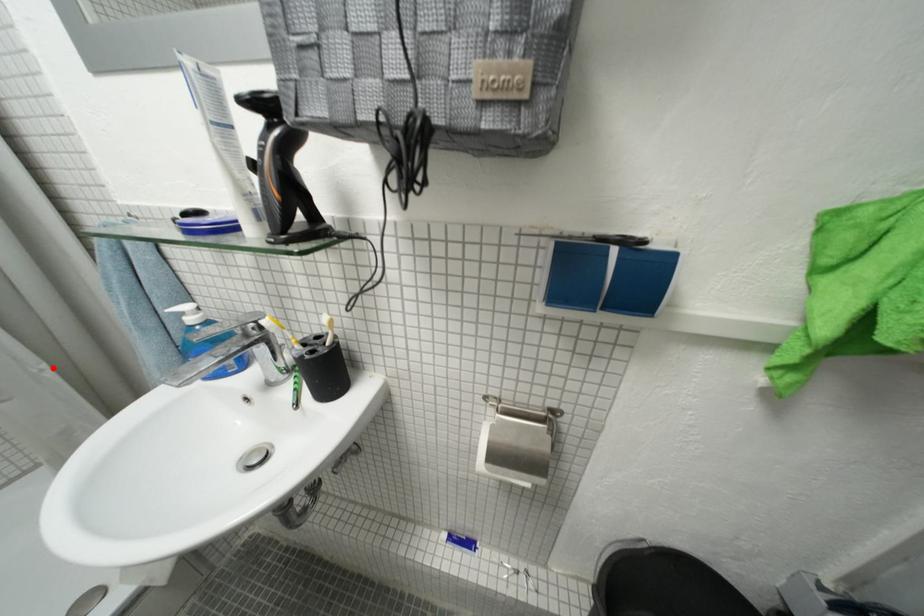
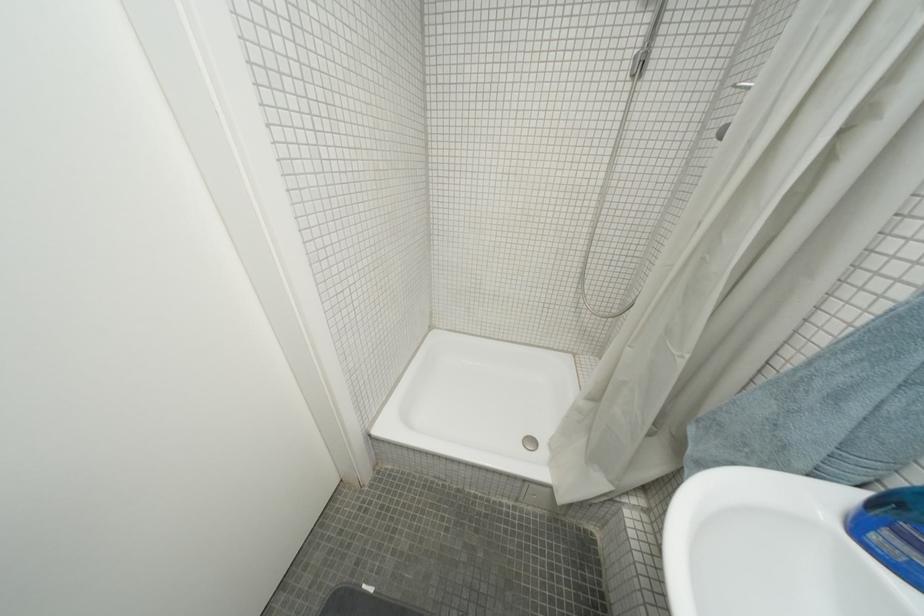
Question: I am providing you with two images of the same scene from different viewpoints. In image1, a red point is highlighted. Considering the same 3D point in image2, which of the following is correct?

Choices:
 (A) It is closer
 (B) It is farther

Answer: (B)